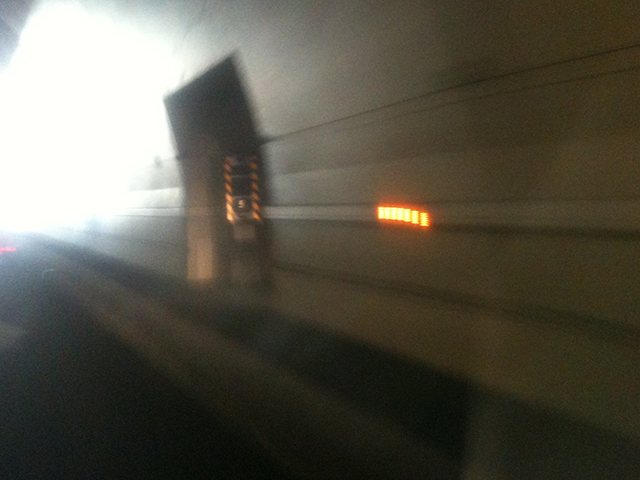
The image size is (640, 480). In order to click on bright light in this screenshot , I will do `click(44, 124)`.